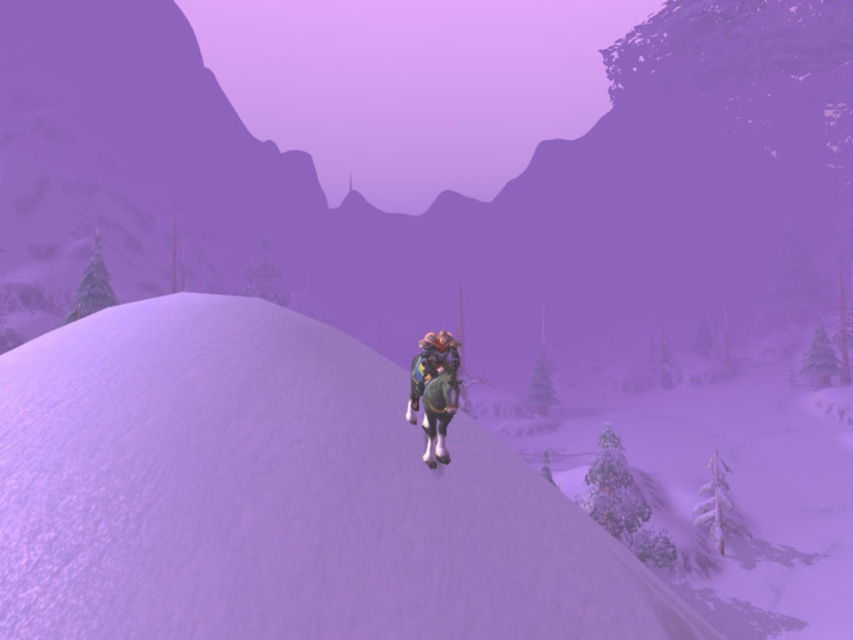
Who is higher up, white matte snow at center or white snow at center?

white matte snow at center is above.

Can you confirm if white matte snow at center is thinner than white snow at center?

Incorrect, white matte snow at center's width is not less than white snow at center's.

Identify the location of white matte snow at center. (444, 193).

The image size is (853, 640). I want to click on white matte snow at center, so click(x=444, y=193).

The image size is (853, 640). What do you see at coordinates (277, 497) in the screenshot? I see `white snow at center` at bounding box center [277, 497].

Is the position of white snow at center less distant than that of shiny blue armor at center?

Yes, it is.

Locate an element on the screen. The image size is (853, 640). white snow at center is located at coordinates (277, 497).

Can you confirm if white matte snow at center is bigger than shiny blue armor at center?

Indeed, white matte snow at center has a larger size compared to shiny blue armor at center.

Is point (648, 116) positioned after point (450, 358)?

Yes, it is.

Where is `white matte snow at center`? This screenshot has height=640, width=853. white matte snow at center is located at coordinates (444, 193).